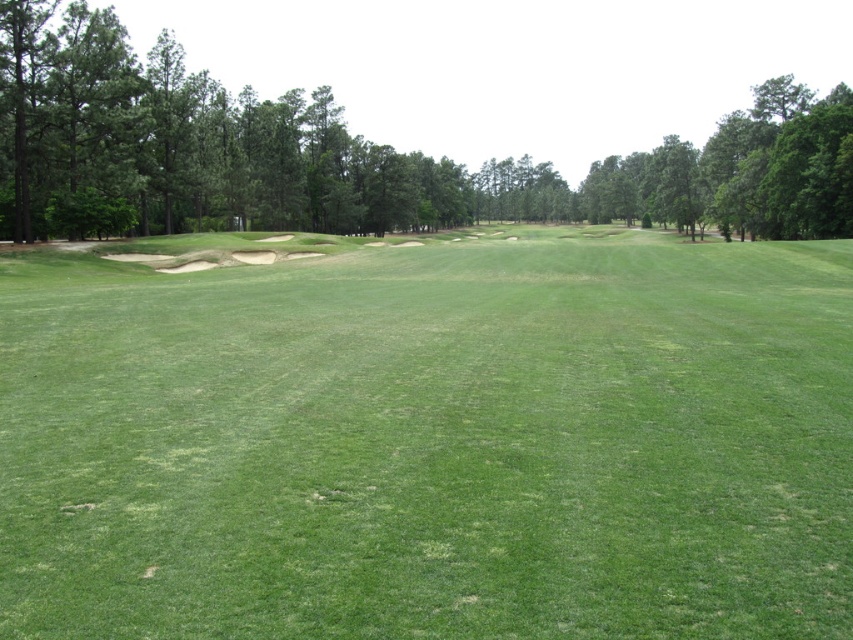
Question: From the image, what is the correct spatial relationship of green grassy field at center in relation to green leafy tree at center?

Choices:
 (A) right
 (B) left

Answer: (B)

Question: Among these points, which one is farthest from the camera?

Choices:
 (A) (801, 440)
 (B) (531, 180)

Answer: (B)

Question: Does green grassy field at center appear on the left side of green leafy tree at center?

Choices:
 (A) yes
 (B) no

Answer: (A)

Question: Which point appears farthest from the camera in this image?

Choices:
 (A) (370, 225)
 (B) (619, 236)

Answer: (B)

Question: Which point is closer to the camera?

Choices:
 (A) (521, 588)
 (B) (782, 176)

Answer: (A)

Question: Does green grassy field at center have a larger size compared to green leafy tree at center?

Choices:
 (A) no
 (B) yes

Answer: (A)